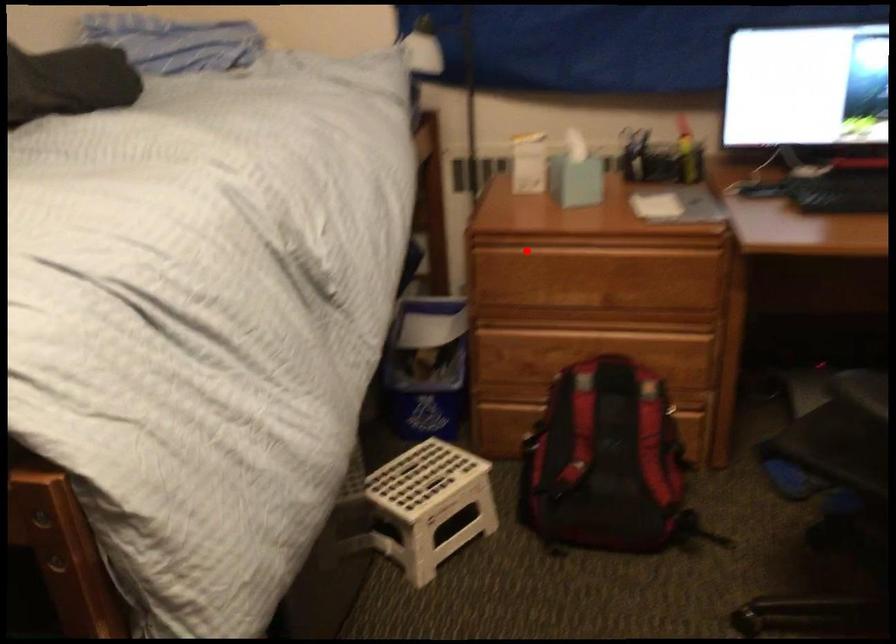
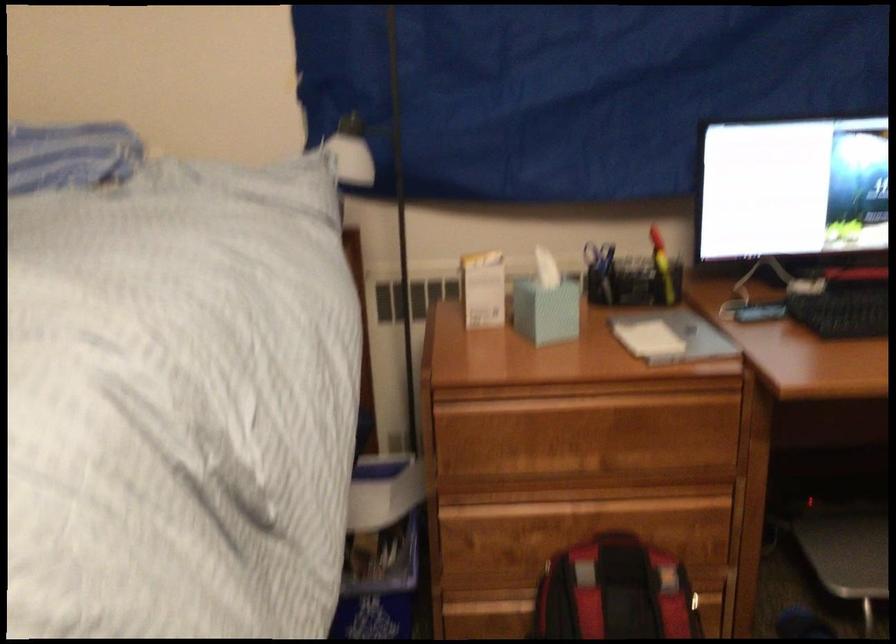
The point at the highlighted location is marked in the first image. Where is the corresponding point in the second image?

(497, 406)